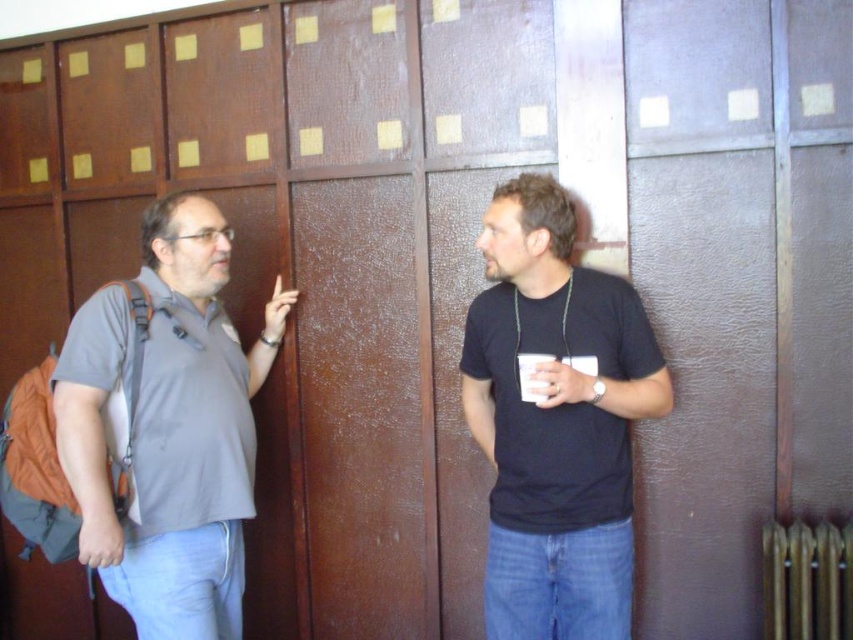
Question: Does black matte shirt at right come behind metallic gold radiator at lower right?

Choices:
 (A) yes
 (B) no

Answer: (B)

Question: Is gray cotton shirt at left further to camera compared to metallic gold radiator at lower right?

Choices:
 (A) no
 (B) yes

Answer: (A)

Question: Which point is farther from the camera taking this photo?

Choices:
 (A) click(x=189, y=291)
 (B) click(x=624, y=522)

Answer: (A)

Question: Which of the following is the closest to the observer?

Choices:
 (A) black matte shirt at right
 (B) metallic gold radiator at lower right
 (C) gray cotton shirt at left

Answer: (C)

Question: Which object is the closest to the gray cotton shirt at left?

Choices:
 (A) black matte shirt at right
 (B) metallic gold radiator at lower right

Answer: (A)

Question: Is black matte shirt at right below gray cotton shirt at left?

Choices:
 (A) no
 (B) yes

Answer: (A)